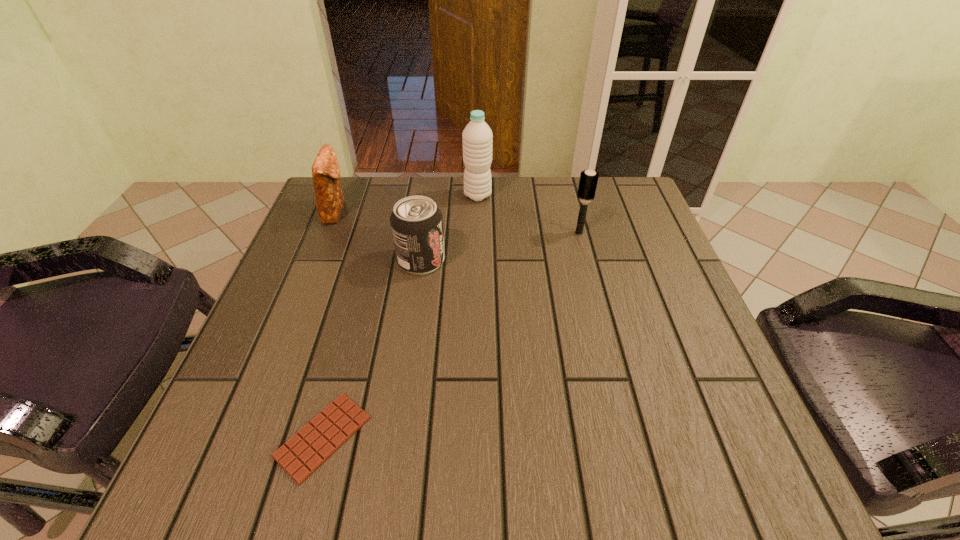
Identify the location of water bottle. Image resolution: width=960 pixels, height=540 pixels. (477, 136).

Identify the location of the tallest object. (477, 136).

Find the location of `hairbrush`. hairbrush is located at coordinates [588, 181].

At what (x,y) coordinates should I click in order to perform the action: click on the rightmost object. Please return your answer as a coordinate pair (x, y). Image resolution: width=960 pixels, height=540 pixels. Looking at the image, I should click on (588, 181).

The image size is (960, 540). Identify the location of clutch bag. (329, 197).

The height and width of the screenshot is (540, 960). Identify the location of soda can. (416, 222).

The image size is (960, 540). I want to click on the nearest object, so click(x=317, y=441).

Where is `the shortest object`? the shortest object is located at coordinates (317, 441).

In order to click on vacant space situated on the right of the tallest object in this screenshot , I will do `click(547, 196)`.

You are a GUI agent. You are given a task and a screenshot of the screen. Output one action in this format:
    pyautogui.click(x=<x>, y=<y>)
    Task: Click on the vacant point located on the front of the hairbrush
    The height and width of the screenshot is (540, 960).
    Given the screenshot: What is the action you would take?
    pyautogui.click(x=598, y=309)